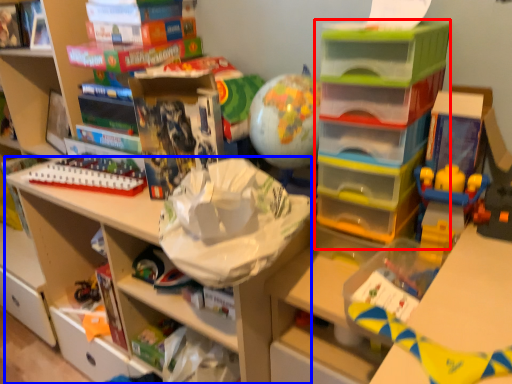
Question: Which object appears farthest to the camera in this image, shelf (highlighted by a red box) or shelf (highlighted by a blue box)?

Choices:
 (A) shelf
 (B) shelf

Answer: (B)